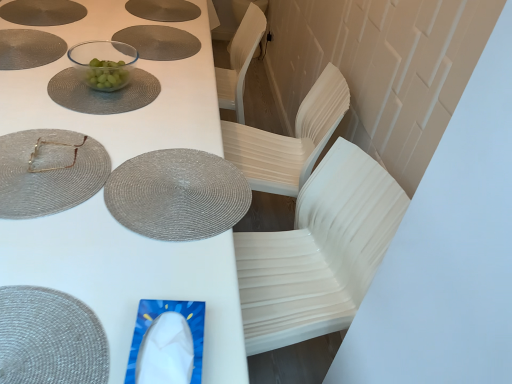
Where is `vacant space that is in between transparent glass bowl at upper center, the first glass plate in the back-to-front sequence, and matte gray placemat at upper center, which appears as the 2th plate when viewed from the left`? This screenshot has height=384, width=512. vacant space that is in between transparent glass bowl at upper center, the first glass plate in the back-to-front sequence, and matte gray placemat at upper center, which appears as the 2th plate when viewed from the left is located at coordinates (137, 59).